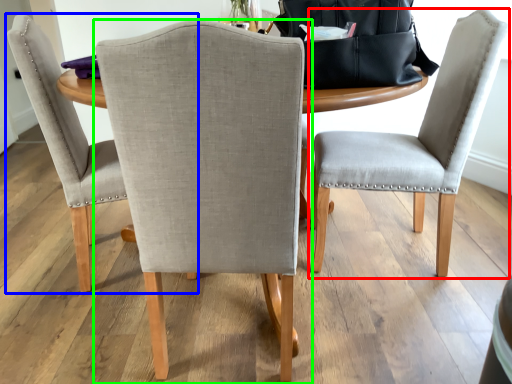
Question: Based on their relative distances, which object is farther from chair (highlighted by a red box)? Choose from chair (highlighted by a blue box) and chair (highlighted by a green box).

Choices:
 (A) chair
 (B) chair

Answer: (A)